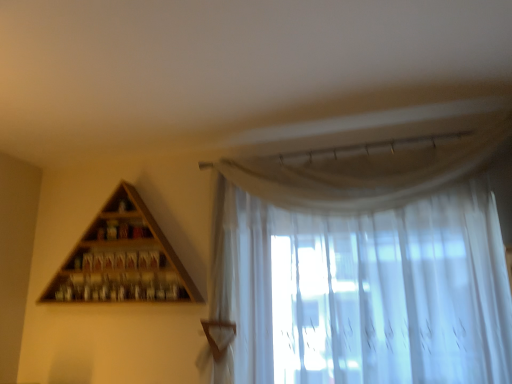
Question: Would you say sheer white curtain at upper right is outside wooden triangle at upper left?

Choices:
 (A) no
 (B) yes

Answer: (B)

Question: Does sheer white curtain at upper right contain wooden triangle at upper left?

Choices:
 (A) no
 (B) yes

Answer: (A)

Question: Is sheer white curtain at upper right shorter than wooden triangle at upper left?

Choices:
 (A) yes
 (B) no

Answer: (B)

Question: Considering the relative positions of sheer white curtain at upper right and wooden triangle at upper left in the image provided, is sheer white curtain at upper right to the left of wooden triangle at upper left from the viewer's perspective?

Choices:
 (A) yes
 (B) no

Answer: (B)

Question: Considering the relative sizes of sheer white curtain at upper right and wooden triangle at upper left in the image provided, is sheer white curtain at upper right smaller than wooden triangle at upper left?

Choices:
 (A) yes
 (B) no

Answer: (B)

Question: Is sheer white curtain at upper right next to wooden triangle at upper left and touching it?

Choices:
 (A) yes
 (B) no

Answer: (B)

Question: Is sheer white curtain at upper right at the back of wooden triangle at upper left?

Choices:
 (A) yes
 (B) no

Answer: (B)

Question: Is wooden triangle at upper left bigger than sheer white curtain at upper right?

Choices:
 (A) no
 (B) yes

Answer: (A)

Question: Can you confirm if wooden triangle at upper left is smaller than sheer white curtain at upper right?

Choices:
 (A) no
 (B) yes

Answer: (B)

Question: Considering the relative sizes of wooden triangle at upper left and sheer white curtain at upper right in the image provided, is wooden triangle at upper left taller than sheer white curtain at upper right?

Choices:
 (A) no
 (B) yes

Answer: (A)

Question: Does wooden triangle at upper left turn towards sheer white curtain at upper right?

Choices:
 (A) no
 (B) yes

Answer: (A)

Question: Is wooden triangle at upper left far from sheer white curtain at upper right?

Choices:
 (A) yes
 (B) no

Answer: (B)

Question: Considering their positions, is wooden triangle at upper left located in front of or behind sheer white curtain at upper right?

Choices:
 (A) front
 (B) behind

Answer: (B)